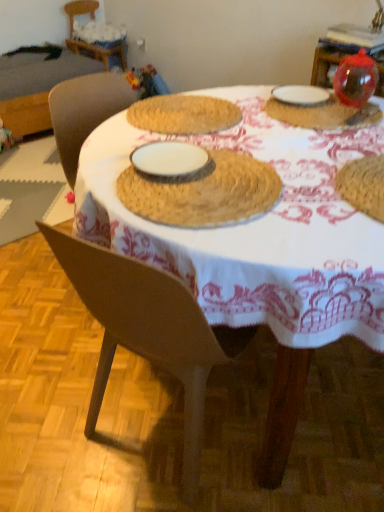
Question: Does transparent plastic ornament at upper right, the 1th tableware viewed from the right, have a smaller size compared to transparent plastic ball at upper right, the 2th tableware in the right-to-left sequence?

Choices:
 (A) yes
 (B) no

Answer: (B)

Question: Is transparent plastic ornament at upper right, the 1th tableware viewed from the right, next to transparent plastic ball at upper right, the second tableware in the left-to-right sequence?

Choices:
 (A) no
 (B) yes

Answer: (A)

Question: From the image's perspective, does transparent plastic ornament at upper right, the third tableware from the left, appear higher than transparent plastic ball at upper right, the second tableware in the left-to-right sequence?

Choices:
 (A) no
 (B) yes

Answer: (B)

Question: Would you consider transparent plastic ornament at upper right, the 1th tableware viewed from the right, to be distant from transparent plastic ball at upper right, the 2th tableware in the right-to-left sequence?

Choices:
 (A) yes
 (B) no

Answer: (B)

Question: Is transparent plastic ornament at upper right, the 1th tableware viewed from the right, behind transparent plastic ball at upper right, the second tableware in the left-to-right sequence?

Choices:
 (A) yes
 (B) no

Answer: (A)

Question: From a real-world perspective, is transparent plastic ornament at upper right, the third tableware from the left, below transparent plastic ball at upper right, the 2th tableware in the right-to-left sequence?

Choices:
 (A) no
 (B) yes

Answer: (A)

Question: Is white ceramic plate at upper right, the first tableware viewed from the left, not within woven straw placemat at center, arranged as the first table when viewed from the right?

Choices:
 (A) no
 (B) yes

Answer: (A)

Question: Does white ceramic plate at upper right, the first tableware viewed from the left, touch woven straw placemat at center, which is counted as the 2th table, starting from the back?

Choices:
 (A) no
 (B) yes

Answer: (A)

Question: Considering the relative sizes of white ceramic plate at upper right, marked as the 3th tableware in a right-to-left arrangement, and woven straw placemat at center, positioned as the 1th table in front-to-back order, in the image provided, is white ceramic plate at upper right, marked as the 3th tableware in a right-to-left arrangement, bigger than woven straw placemat at center, positioned as the 1th table in front-to-back order,?

Choices:
 (A) yes
 (B) no

Answer: (B)

Question: Is white ceramic plate at upper right, the first tableware viewed from the left, not near woven straw placemat at center, which appears as the second table when viewed from the top?

Choices:
 (A) yes
 (B) no

Answer: (B)

Question: Does white ceramic plate at upper right, the first tableware viewed from the left, lie behind woven straw placemat at center, which is counted as the 2th table, starting from the back?

Choices:
 (A) yes
 (B) no

Answer: (A)

Question: Can you confirm if white ceramic plate at upper right, marked as the 3th tableware in a right-to-left arrangement, is taller than woven straw placemat at center, positioned as the 1th table in front-to-back order?

Choices:
 (A) yes
 (B) no

Answer: (B)

Question: Is woven straw placemat at upper left, arranged as the 2th table when viewed from the front, next to transparent plastic ball at upper right, the second tableware in the left-to-right sequence?

Choices:
 (A) yes
 (B) no

Answer: (B)